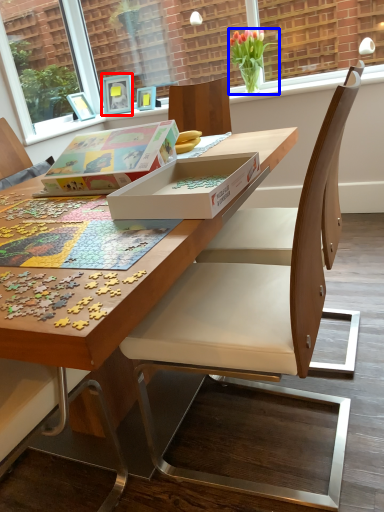
Question: Among these objects, which one is farthest to the camera, picture frame (highlighted by a red box) or houseplant (highlighted by a blue box)?

Choices:
 (A) picture frame
 (B) houseplant

Answer: (A)